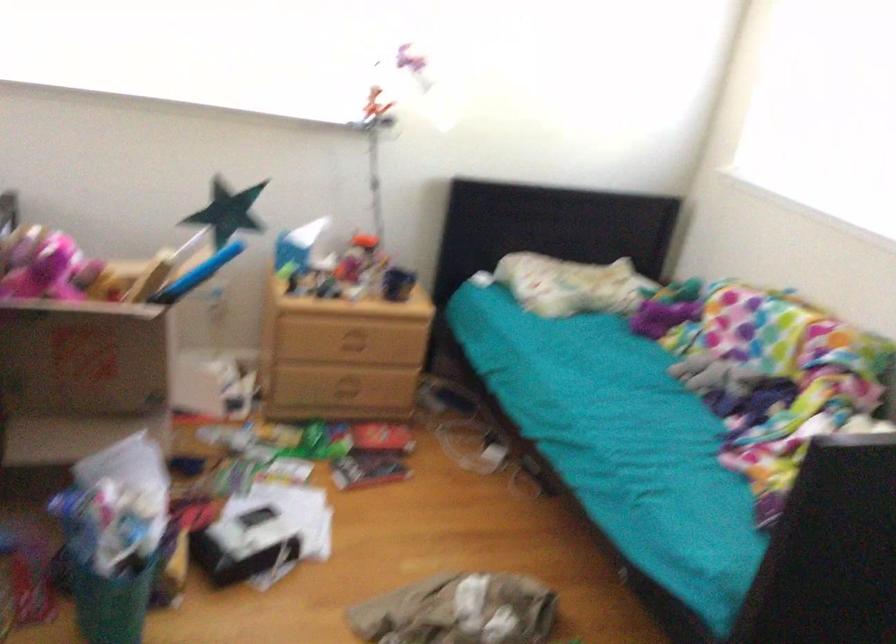
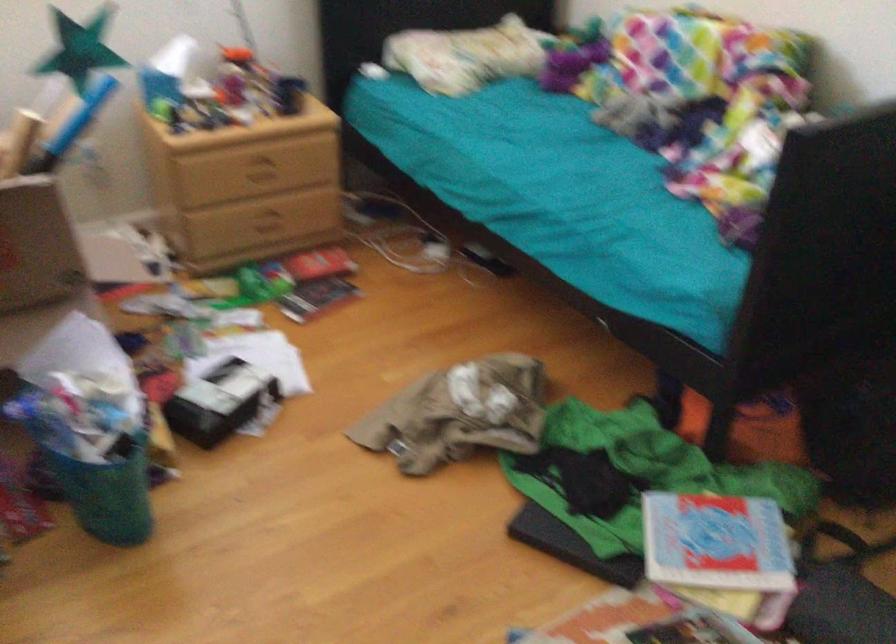
Find the pixel in the second image that matches point (536, 473) in the first image.

(481, 259)